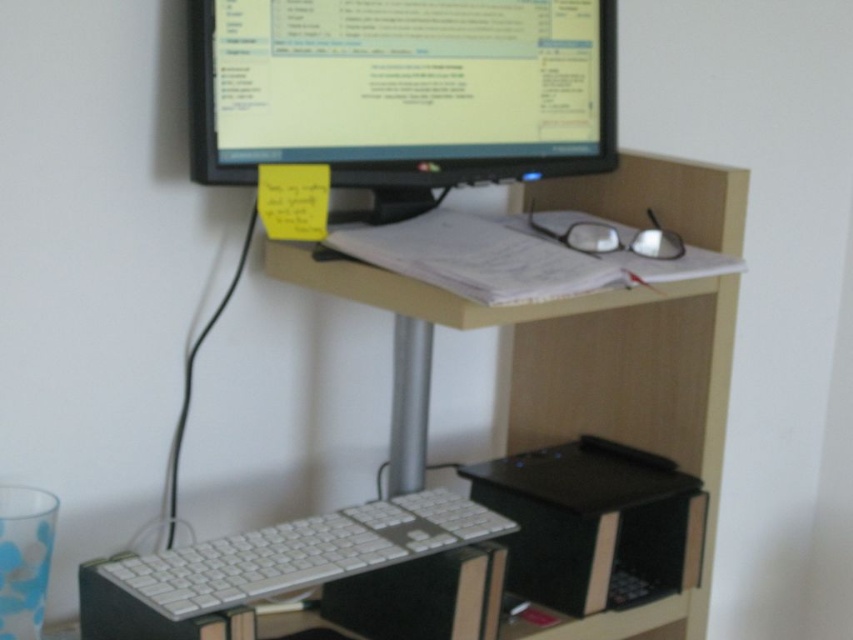
In the scene shown: Does wooden computer desk at center have a lesser width compared to matte black monitor at upper center?

Incorrect, wooden computer desk at center's width is not less than matte black monitor at upper center's.

Between wooden computer desk at center and matte black monitor at upper center, which one is positioned higher?

matte black monitor at upper center

Where is `wooden computer desk at center`? The image size is (853, 640). wooden computer desk at center is located at coordinates (506, 433).

Find the location of `wooden computer desk at center`. wooden computer desk at center is located at coordinates (506, 433).

From the picture: Does matte black monitor at upper center have a larger size compared to white plastic keyboard at center?

Correct, matte black monitor at upper center is larger in size than white plastic keyboard at center.

Describe the element at coordinates (403, 88) in the screenshot. The width and height of the screenshot is (853, 640). I see `matte black monitor at upper center` at that location.

Locate an element on the screen. The width and height of the screenshot is (853, 640). matte black monitor at upper center is located at coordinates (403, 88).

Based on the photo, between wooden computer desk at center and white plastic keyboard at center, which one appears on the left side from the viewer's perspective?

white plastic keyboard at center

Can you confirm if wooden computer desk at center is bigger than white plastic keyboard at center?

Indeed, wooden computer desk at center has a larger size compared to white plastic keyboard at center.

Which is behind, point (239, 612) or point (321, 579)?

Positioned behind is point (321, 579).

The image size is (853, 640). I want to click on wooden computer desk at center, so click(x=506, y=433).